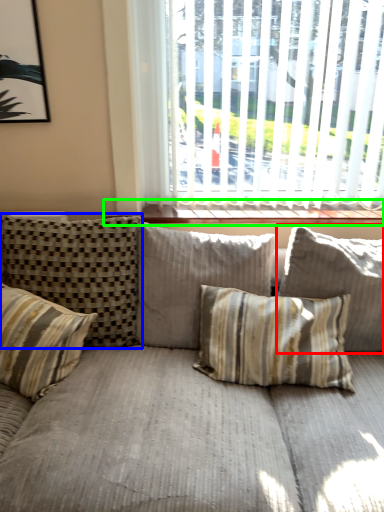
Question: Considering the real-world distances, which object is closest to pillow (highlighted by a red box)? pillow (highlighted by a blue box) or window sill (highlighted by a green box).

Choices:
 (A) pillow
 (B) window sill

Answer: (B)